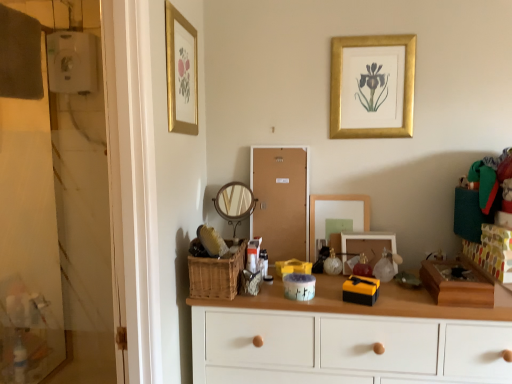
Question: Can you confirm if wooden picture frame at center, which is the third picture frame from top to bottom, is taller than wooden box at right?

Choices:
 (A) yes
 (B) no

Answer: (A)

Question: Are wooden picture frame at center, the 2th picture frame from the left, and wooden box at right making contact?

Choices:
 (A) yes
 (B) no

Answer: (B)

Question: Can you confirm if wooden picture frame at center, the 2th picture frame from the left, is wider than wooden box at right?

Choices:
 (A) no
 (B) yes

Answer: (A)

Question: From the image's perspective, is wooden picture frame at center, the 2th picture frame from the left, located beneath wooden box at right?

Choices:
 (A) no
 (B) yes

Answer: (A)

Question: Would you say wooden picture frame at center, which is the third picture frame from top to bottom, contains wooden box at right?

Choices:
 (A) no
 (B) yes

Answer: (A)

Question: From the image's perspective, is shiny metallic toy at center located above or below white wood chest of drawers at center?

Choices:
 (A) below
 (B) above

Answer: (B)

Question: Considering the positions of shiny metallic toy at center and white wood chest of drawers at center in the image, is shiny metallic toy at center bigger or smaller than white wood chest of drawers at center?

Choices:
 (A) big
 (B) small

Answer: (B)

Question: Is point (359, 268) positioned closer to the camera than point (401, 349)?

Choices:
 (A) closer
 (B) farther

Answer: (B)

Question: Considering the relative positions of shiny metallic toy at center and white wood chest of drawers at center in the image provided, is shiny metallic toy at center to the left or to the right of white wood chest of drawers at center?

Choices:
 (A) right
 (B) left

Answer: (A)

Question: From a real-world perspective, is wooden box at right physically located above or below woven brown basket at center?

Choices:
 (A) below
 (B) above

Answer: (A)

Question: Is point (437, 297) closer or farther from the camera than point (202, 264)?

Choices:
 (A) farther
 (B) closer

Answer: (B)

Question: Is wooden box at right wider or thinner than woven brown basket at center?

Choices:
 (A) thin
 (B) wide

Answer: (B)

Question: Based on their positions, is wooden box at right located to the left or right of woven brown basket at center?

Choices:
 (A) left
 (B) right

Answer: (B)

Question: Do you think white wood chest of drawers at center is within wooden round mirror at center, acting as the second mirror starting from the right, or outside of it?

Choices:
 (A) outside
 (B) inside

Answer: (A)

Question: Is white wood chest of drawers at center wider or thinner than wooden round mirror at center, acting as the second mirror starting from the right?

Choices:
 (A) wide
 (B) thin

Answer: (A)